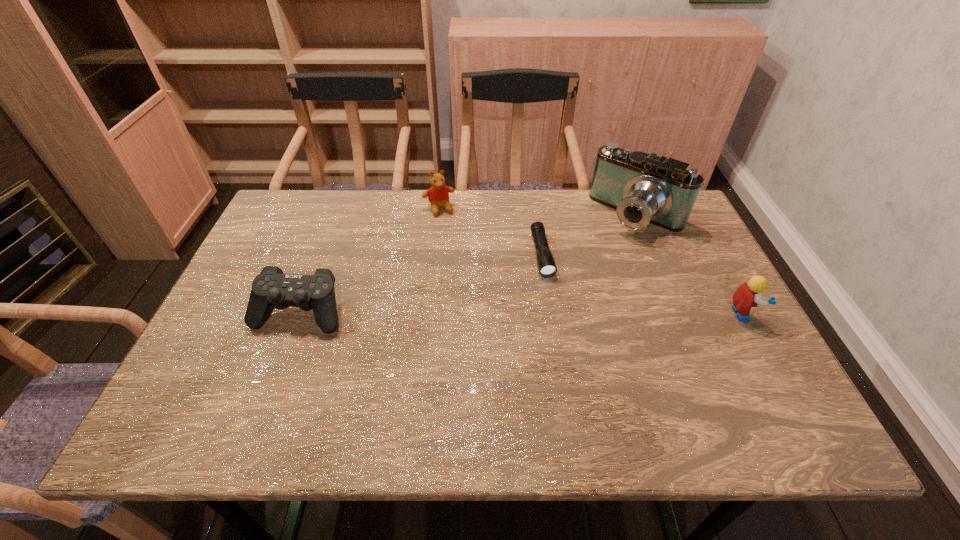
Where is `free space on the desktop that is between the fourth tallest object and the Lego and is positioned at the lens end of the third object from left to right`? This screenshot has width=960, height=540. free space on the desktop that is between the fourth tallest object and the Lego and is positioned at the lens end of the third object from left to right is located at coordinates coord(557,313).

This screenshot has height=540, width=960. Identify the location of vacant space on the desktop that is between the leftmost object and the Lego and is positioned on the front-facing side of the fourth object from right to left. (485, 313).

You are a GUI agent. You are given a task and a screenshot of the screen. Output one action in this format:
    pyautogui.click(x=<x>, y=<y>)
    Task: Click on the free space on the desktop that is between the leftmost object and the Lego and is positioned on the front-facing side of the camcorder
    Image resolution: width=960 pixels, height=540 pixels.
    Given the screenshot: What is the action you would take?
    pyautogui.click(x=554, y=313)